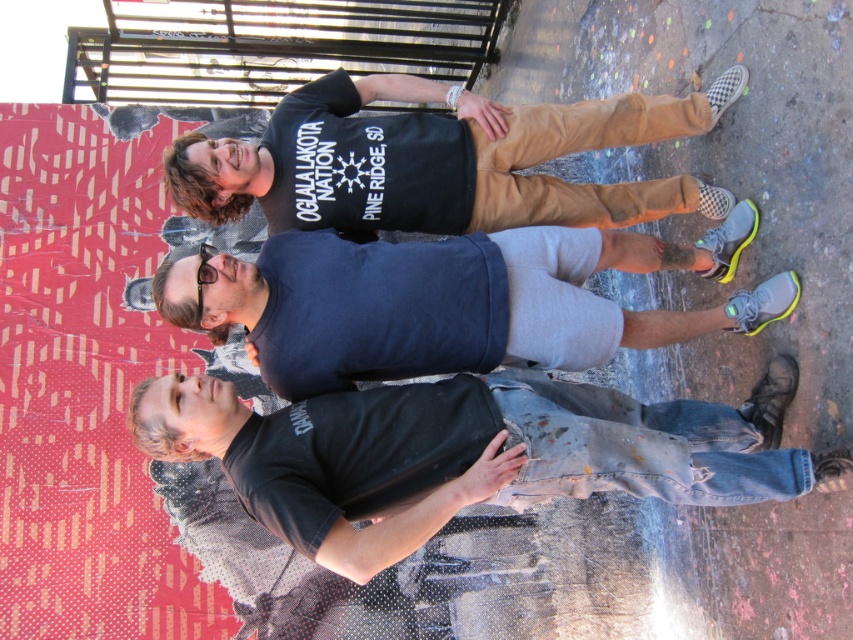
Question: Is black matte skateboard at lower center smaller than black cotton t-shirt at upper center?

Choices:
 (A) no
 (B) yes

Answer: (A)

Question: Can you confirm if black matte skateboard at lower center is positioned below black cotton t-shirt at upper center?

Choices:
 (A) yes
 (B) no

Answer: (A)

Question: Which object is the closest to the black cotton t-shirt at upper center?

Choices:
 (A) black matte skateboard at lower center
 (B) dark blue t-shirt at center

Answer: (B)

Question: Which point is closer to the camera taking this photo?

Choices:
 (A) (328, 400)
 (B) (453, 308)

Answer: (A)

Question: Estimate the real-world distances between objects in this image. Which object is closer to the black cotton t-shirt at upper center?

Choices:
 (A) black matte skateboard at lower center
 (B) dark blue t-shirt at center

Answer: (B)

Question: Does black matte skateboard at lower center appear on the left side of dark blue t-shirt at center?

Choices:
 (A) yes
 (B) no

Answer: (B)